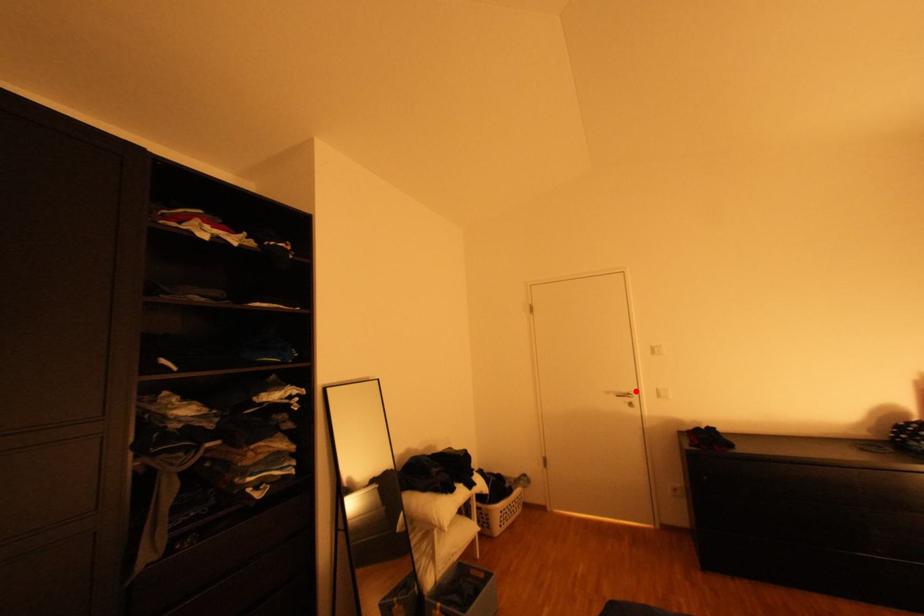
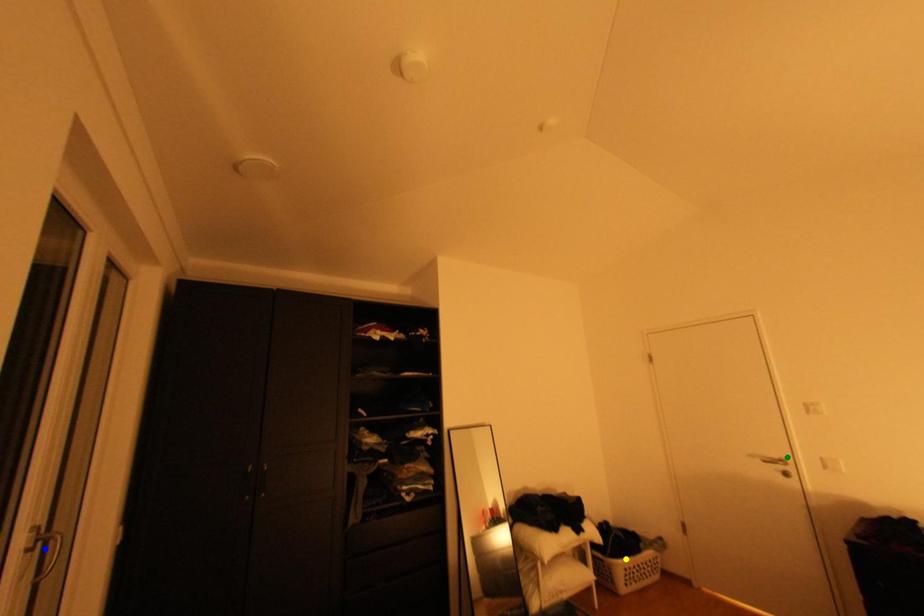
Question: I am providing you with two images of the same scene from different viewpoints. A red point is marked on the first image. You are given multiple points on the second image. Which spot in image 2 lines up with the point in image 1?

Choices:
 (A) blue point
 (B) green point
 (C) yellow point

Answer: (B)